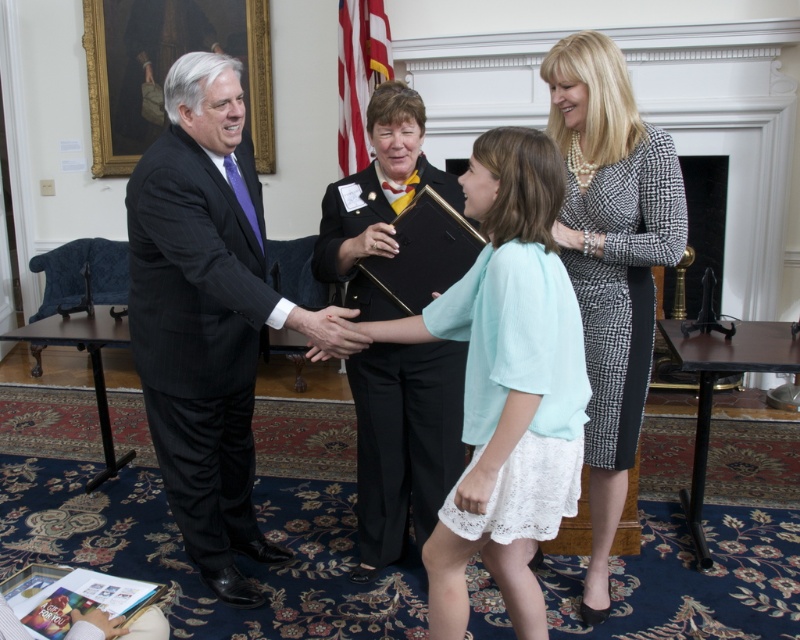
You are organizing a small event and need to place a decorative item between the matte black book at center and the patterned dress at center. Given the space between them is 0.52 inches, can you fit a 1 inch wide ribbon between them?

The space between the matte black book at center and the patterned dress at center is only 0.52 inches, which is narrower than the 1 inch wide ribbon. Therefore, the ribbon cannot fit between them.

You are a guest at this event and want to place a small gift on the table where the matte black book at center and the patterned dress at center are located. Is there enough space between them to place your gift?

The matte black book at center is positioned over the patterned dress at center, so there is no space between them to place your gift.